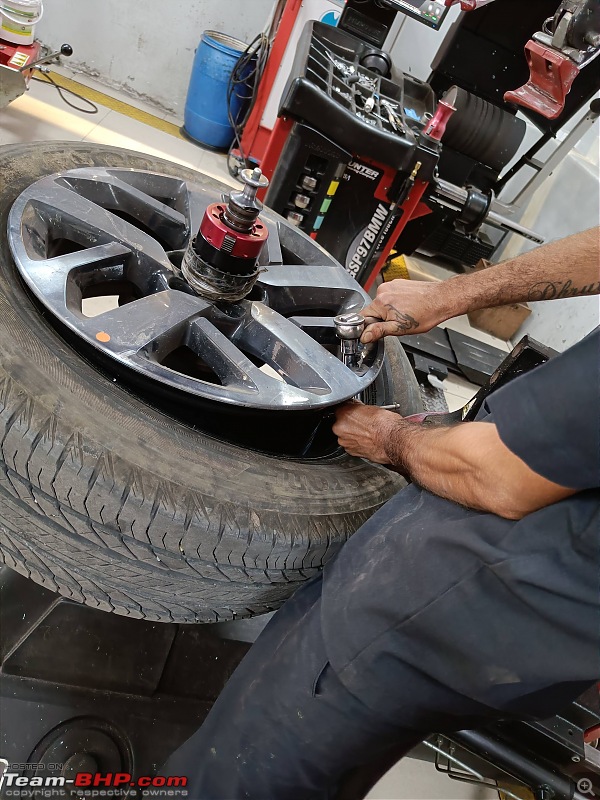
The height and width of the screenshot is (800, 600). In order to click on black wire in this screenshot , I will do `click(243, 78)`.